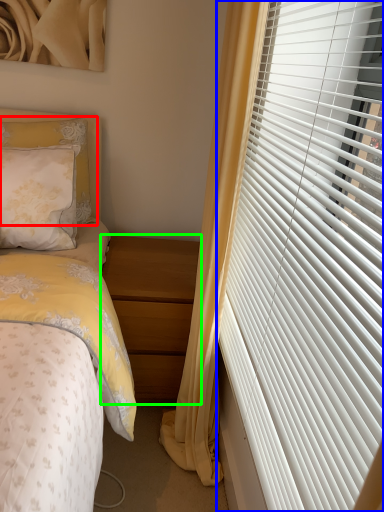
Question: Based on their relative distances, which object is nearer to pillow (highlighted by a red box)? Choose from window blind (highlighted by a blue box) and nightstand (highlighted by a green box).

Choices:
 (A) window blind
 (B) nightstand

Answer: (B)